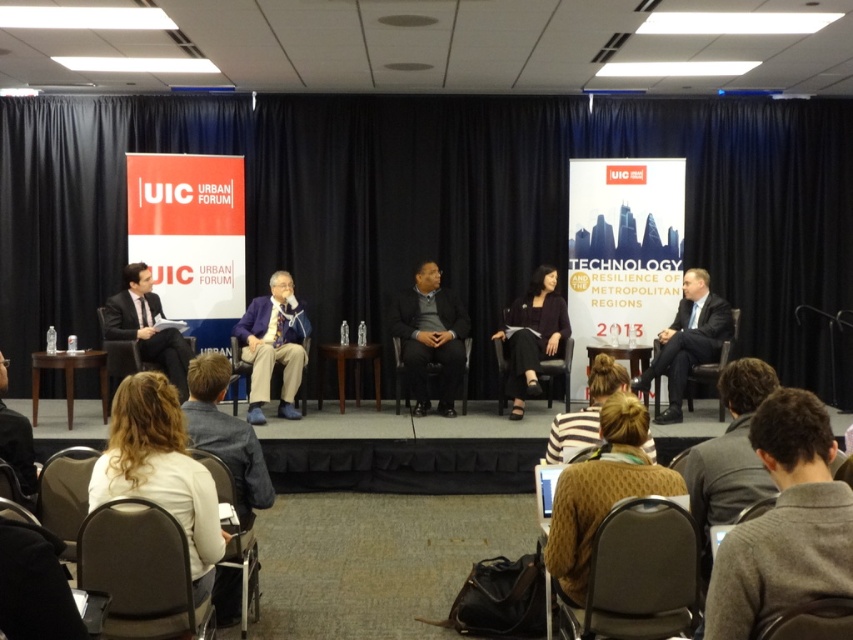
Question: Is dark gray sweater at lower right to the right of velvet brown chair at lower right from the viewer's perspective?

Choices:
 (A) yes
 (B) no

Answer: (A)

Question: Does light brown hair at lower left appear over velvet brown chair at lower right?

Choices:
 (A) yes
 (B) no

Answer: (A)

Question: Can you confirm if dark gray sweater at lower right is wider than striped knit sweater at center?

Choices:
 (A) yes
 (B) no

Answer: (A)

Question: Based on their relative distances, which object is farther from the black fabric chair at lower left?

Choices:
 (A) black fabric chair at center
 (B) black leather chair at center
 (C) black leather chair at lower left

Answer: (B)

Question: Among these objects, which one is farthest from the camera?

Choices:
 (A) blue fabric chair at center
 (B) dark suit at left
 (C) knitted brown sweater at lower center
 (D) striped knit sweater at center

Answer: (A)

Question: Which object appears closest to the camera in this image?

Choices:
 (A) velvet brown chair at lower right
 (B) striped knit sweater at center
 (C) gray fabric chair at lower center

Answer: (A)